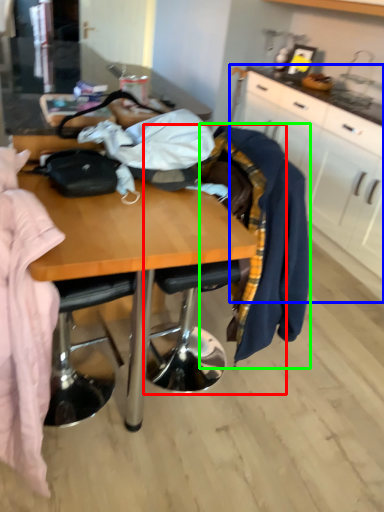
Question: Which object is positioned farthest from chair (highlighted by a red box)? Select from cabinetry (highlighted by a blue box) and clothing (highlighted by a green box).

Choices:
 (A) cabinetry
 (B) clothing

Answer: (A)